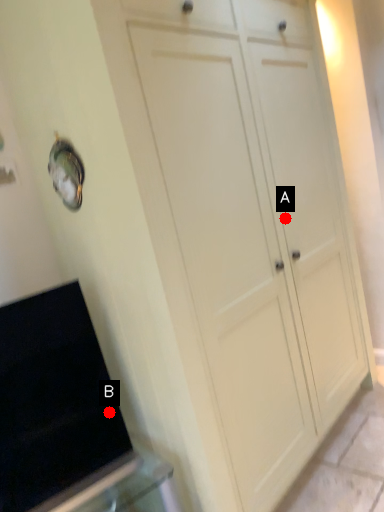
Question: Two points are circled on the image, labeled by A and B beside each circle. Among these points, which one is farthest from the camera?

Choices:
 (A) A is further
 (B) B is further

Answer: (A)